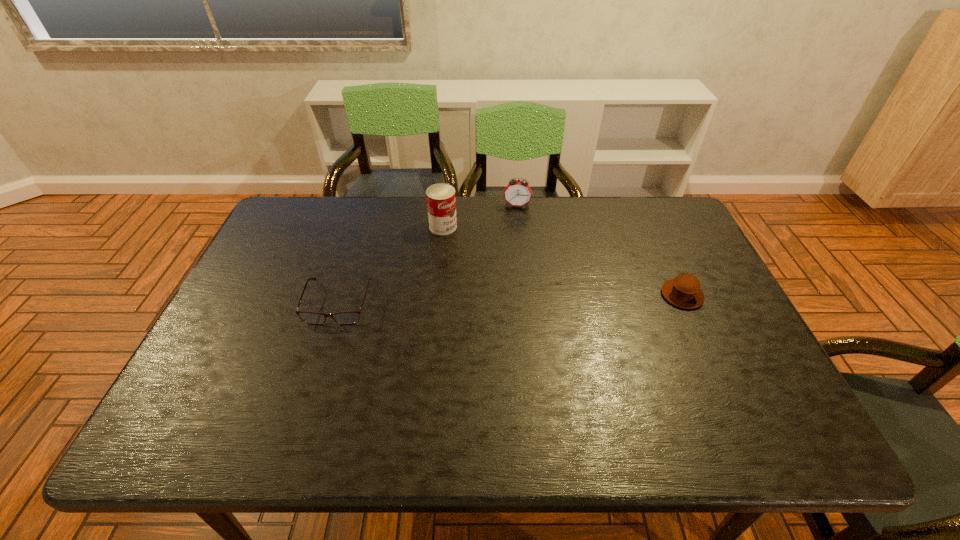
I want to click on vacant spot on the desktop that is between the spectacles and the rightmost object and is positioned on the clock face of the second object from right to left, so click(x=507, y=299).

Identify the location of vacant space on the desktop that is between the shortest object and the rightmost object and is positioned on the front label of the third nearest object. This screenshot has height=540, width=960. (546, 298).